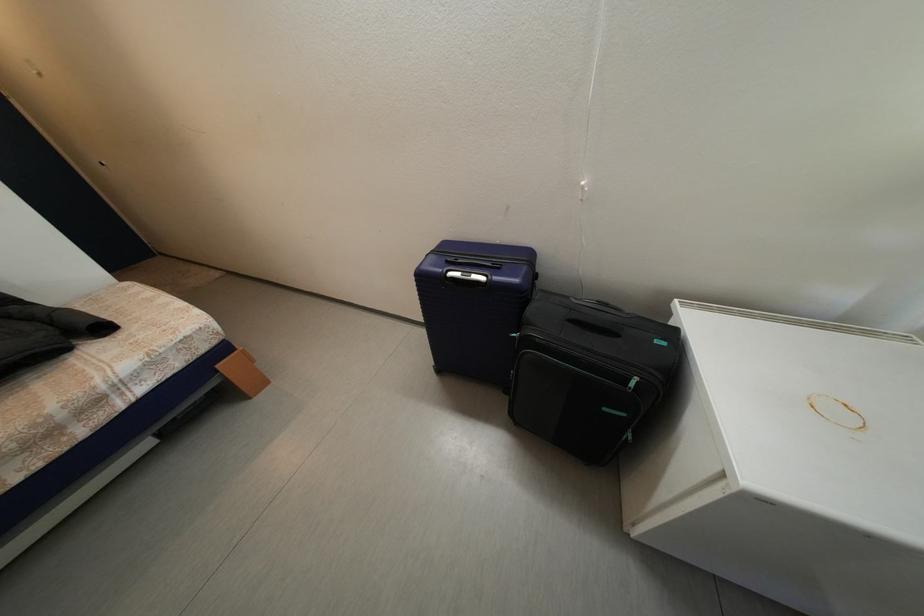
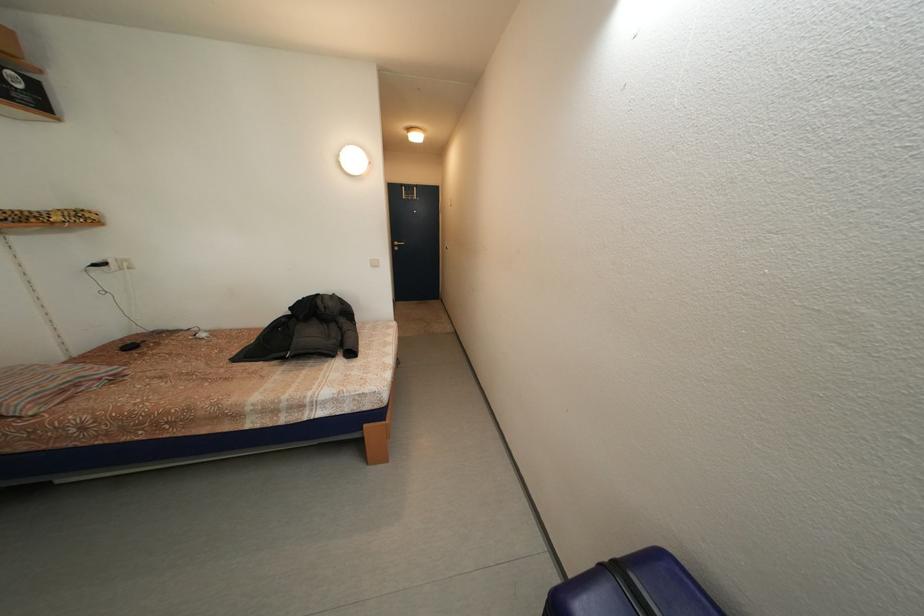
Question: The camera is either moving clockwise (left) or counter-clockwise (right) around the object. The first image is from the beginning of the video and the second image is from the end. Is the camera moving left or right when shooting the video?

Choices:
 (A) Left
 (B) Right

Answer: (B)